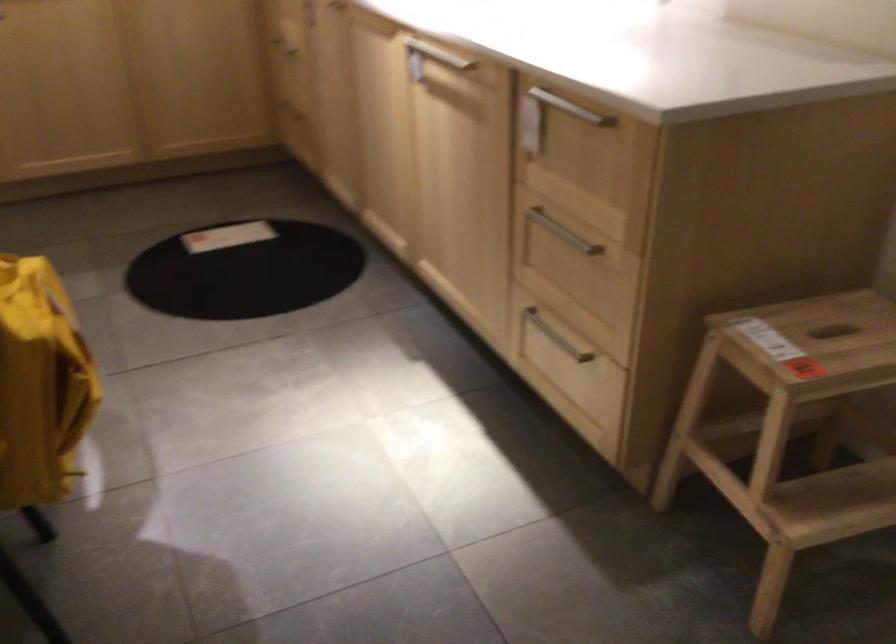
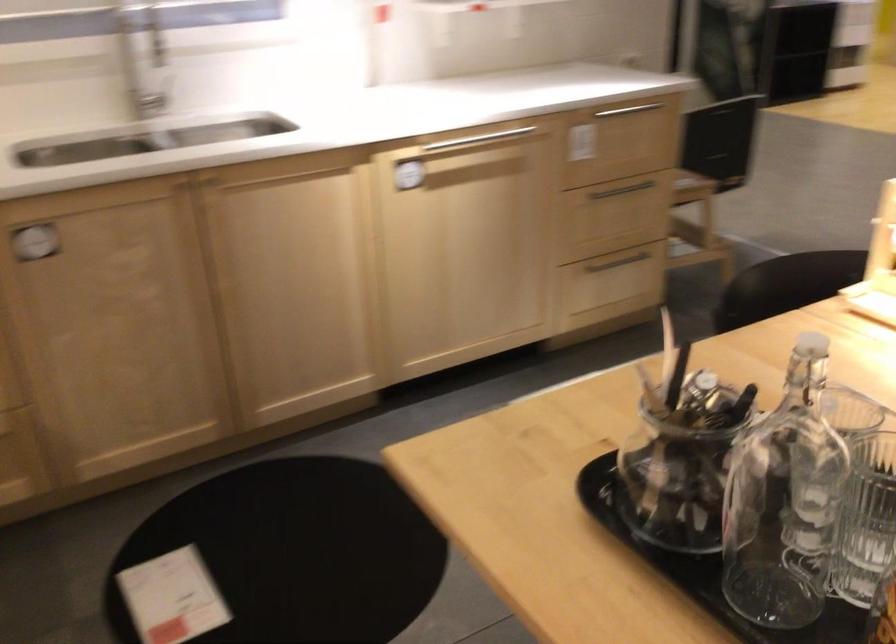
Find the pixel in the second image that matches pixel 564 127 in the first image.

(640, 118)